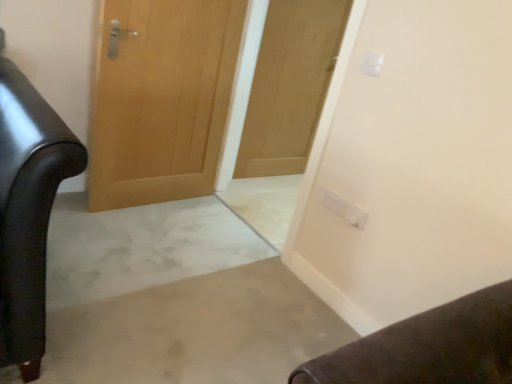
Question: Considering the relative sizes of wooden door at center, the second door positioned from the right, and white plastic electric outlet at upper right, acting as the 2th electric outlet starting from the back, in the image provided, is wooden door at center, the second door positioned from the right, taller than white plastic electric outlet at upper right, acting as the 2th electric outlet starting from the back,?

Choices:
 (A) yes
 (B) no

Answer: (A)

Question: Is wooden door at center, which is the 1th door in left-to-right order, not close to white plastic electric outlet at upper right, the 1th electric outlet when ordered from bottom to top?

Choices:
 (A) yes
 (B) no

Answer: (A)

Question: Would you say wooden door at center, which is the 1th door in left-to-right order, is outside white plastic electric outlet at upper right, marked as the third electric outlet in a top-to-bottom arrangement?

Choices:
 (A) yes
 (B) no

Answer: (A)

Question: Is wooden door at center, which is the 1th door in left-to-right order, oriented towards white plastic electric outlet at upper right, acting as the 2th electric outlet starting from the back?

Choices:
 (A) yes
 (B) no

Answer: (A)

Question: From a real-world perspective, is wooden door at center, which is the 1th door in left-to-right order, located higher than white plastic electric outlet at upper right, the 1th electric outlet when ordered from bottom to top?

Choices:
 (A) no
 (B) yes

Answer: (B)

Question: In terms of width, does white plastic electric outlet at upper right, positioned as the 2th electric outlet in front-to-back order, look wider or thinner when compared to wooden door at center, which is the 1th door in left-to-right order?

Choices:
 (A) wide
 (B) thin

Answer: (B)

Question: Would you say white plastic electric outlet at upper right, positioned as the 2th electric outlet in front-to-back order, is to the left or to the right of wooden door at center, the second door positioned from the right, in the picture?

Choices:
 (A) right
 (B) left

Answer: (A)

Question: Does point (359, 218) appear closer or farther from the camera than point (134, 135)?

Choices:
 (A) closer
 (B) farther

Answer: (A)

Question: From the image's perspective, is white plastic electric outlet at upper right, the 1th electric outlet when ordered from bottom to top, above or below wooden door at center, the second door positioned from the right?

Choices:
 (A) below
 (B) above

Answer: (A)

Question: From a real-world perspective, relative to white plastic electric outlet at upper right, arranged as the third electric outlet when viewed from the front, is wooden door at center, the second door positioned from the right, vertically above or below?

Choices:
 (A) below
 (B) above

Answer: (B)

Question: Relative to white plastic electric outlet at upper right, acting as the 1th electric outlet starting from the back, is wooden door at center, the second door positioned from the right, in front or behind?

Choices:
 (A) behind
 (B) front

Answer: (B)

Question: In terms of width, does wooden door at center, the second door positioned from the right, look wider or thinner when compared to white plastic electric outlet at upper right, arranged as the third electric outlet when viewed from the front?

Choices:
 (A) wide
 (B) thin

Answer: (A)

Question: Would you say wooden door at center, the second door positioned from the right, is to the left or to the right of white plastic electric outlet at upper right, arranged as the 2th electric outlet when viewed from the top, in the picture?

Choices:
 (A) right
 (B) left

Answer: (B)

Question: Do you think white plastic electric outlet at upper right, the 1th electric outlet when ordered from bottom to top, is within wooden door at center, which is the second door in left-to-right order, or outside of it?

Choices:
 (A) inside
 (B) outside

Answer: (B)

Question: Visually, is white plastic electric outlet at upper right, the 1th electric outlet when ordered from bottom to top, positioned to the left or to the right of wooden door at center, which is the second door in left-to-right order?

Choices:
 (A) left
 (B) right

Answer: (B)